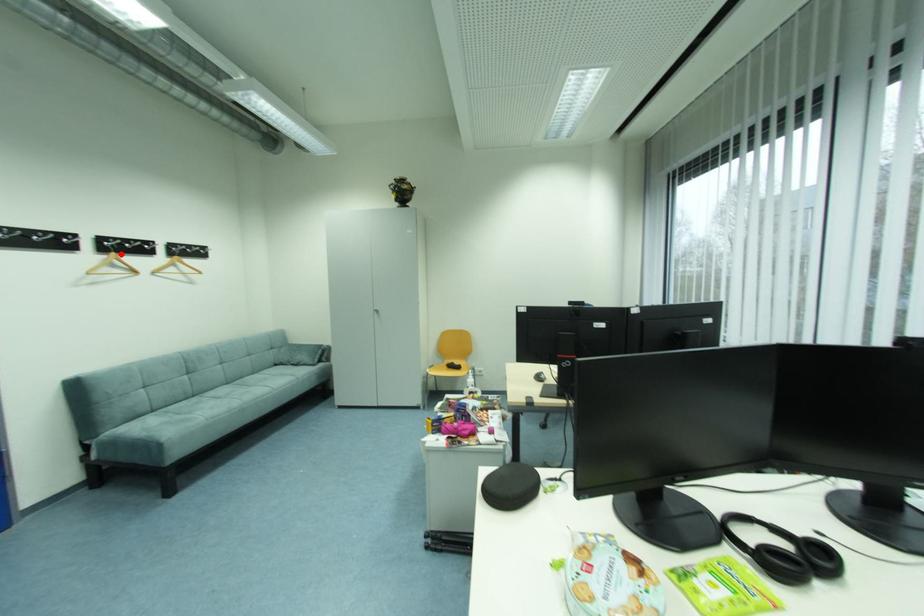
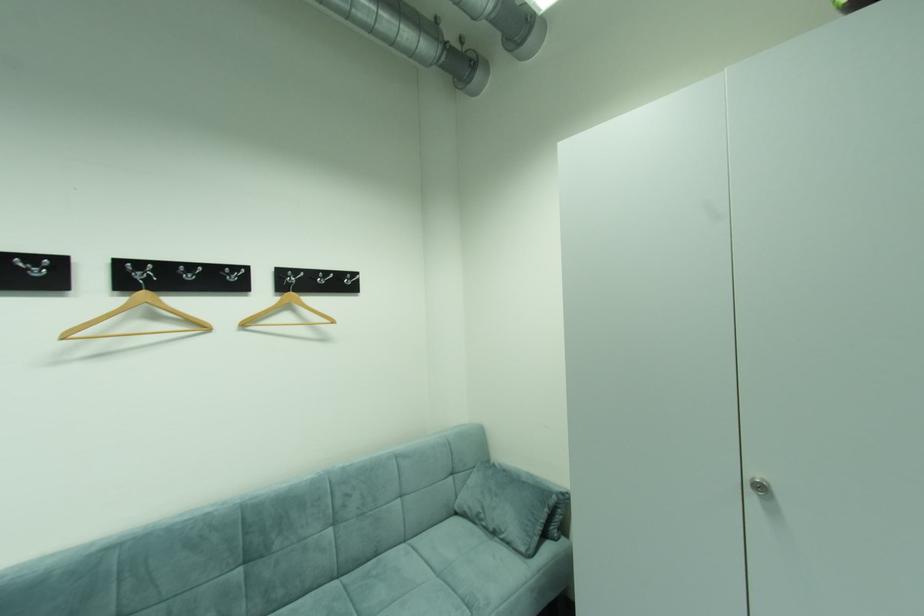
Find the pixel in the second image that matches the highlighted location in the first image.

(150, 294)